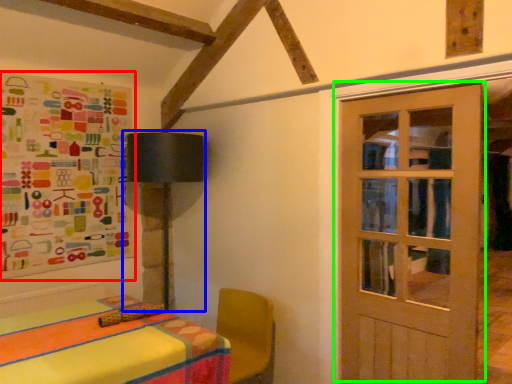
Question: Based on their relative distances, which object is nearer to bulletin board (highlighted by a red box)? Choose from table lamp (highlighted by a blue box) and door (highlighted by a green box).

Choices:
 (A) table lamp
 (B) door

Answer: (A)